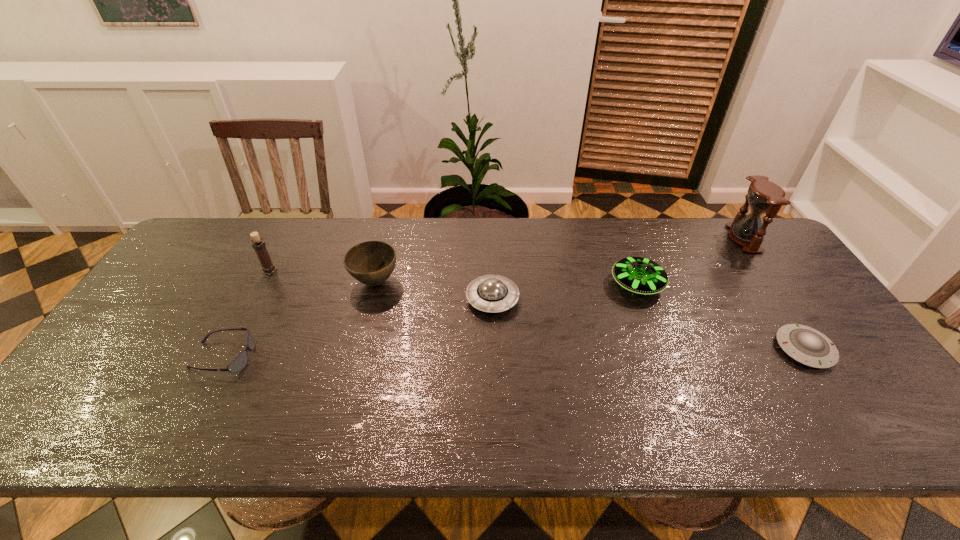
Where is `free point between the sixth shortest object and the tallest saucer`? The width and height of the screenshot is (960, 540). free point between the sixth shortest object and the tallest saucer is located at coordinates (453, 278).

Identify the location of vacant area between the second tallest object and the tallest saucer. This screenshot has height=540, width=960. (453, 278).

Locate an element on the screen. This screenshot has height=540, width=960. free spot between the fifth shortest object and the second shortest object is located at coordinates (300, 319).

Identify the location of vacant space in between the leftmost saucer and the candle holder. (381, 285).

Where is `free area in between the second shortest saucer and the candle holder`? free area in between the second shortest saucer and the candle holder is located at coordinates (381, 285).

The width and height of the screenshot is (960, 540). In order to click on vacant space that's between the fourth object from left to right and the shortest object in this screenshot , I will do `click(648, 324)`.

Locate an element on the screen. empty space between the second shortest object and the candle holder is located at coordinates [x=247, y=314].

Locate an element on the screen. The height and width of the screenshot is (540, 960). free point between the shortest saucer and the second tallest object is located at coordinates (537, 310).

The width and height of the screenshot is (960, 540). Find the location of `unoccupied area between the fourth object from right to left and the sunglasses`. unoccupied area between the fourth object from right to left and the sunglasses is located at coordinates (358, 328).

Locate an element on the screen. This screenshot has height=540, width=960. object that is the sixth closest to the fourth object from left to right is located at coordinates (764, 196).